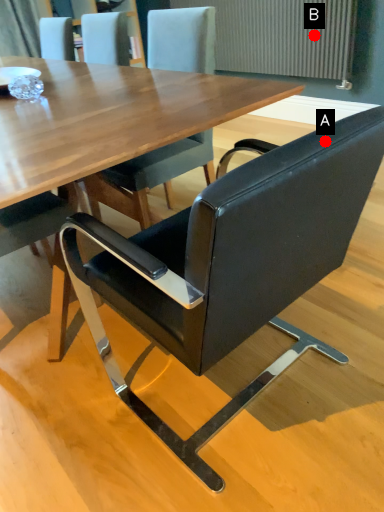
Question: Two points are circled on the image, labeled by A and B beside each circle. Which point is farther from the camera taking this photo?

Choices:
 (A) A is further
 (B) B is further

Answer: (B)